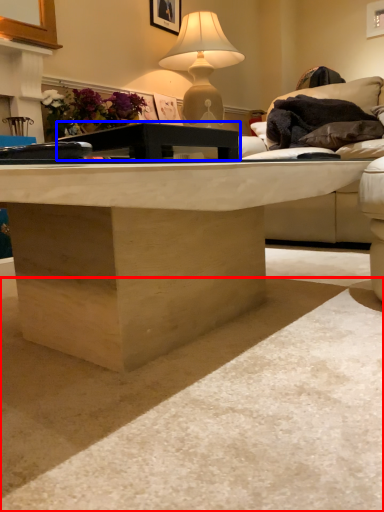
Question: Which object appears farthest to the camera in this image, concrete (highlighted by a red box) or table (highlighted by a blue box)?

Choices:
 (A) concrete
 (B) table

Answer: (B)